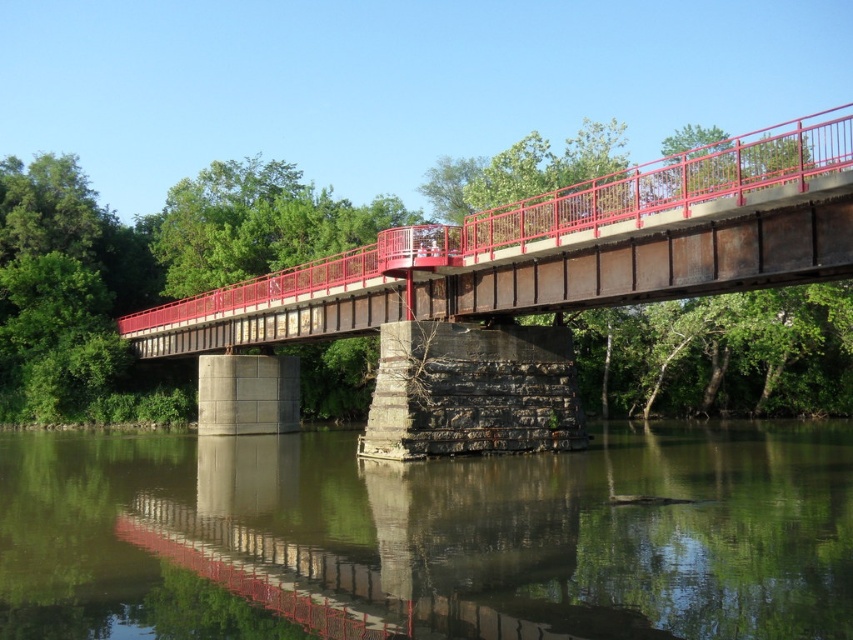
Does green reflective water at lower center appear on the left side of rusty metal bridge at center?

Correct, you'll find green reflective water at lower center to the left of rusty metal bridge at center.

Between green reflective water at lower center and rusty metal bridge at center, which one is positioned lower?

green reflective water at lower center is below.

The height and width of the screenshot is (640, 853). What do you see at coordinates (428, 536) in the screenshot?
I see `green reflective water at lower center` at bounding box center [428, 536].

At what (x,y) coordinates should I click in order to perform the action: click on green reflective water at lower center. Please return your answer as a coordinate pair (x, y). Looking at the image, I should click on (428, 536).